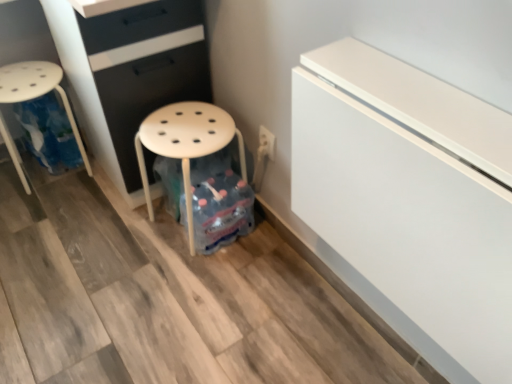
The width and height of the screenshot is (512, 384). In order to click on vacant space situated above white matte stool at center (from a real-world perspective) in this screenshot , I will do `click(186, 113)`.